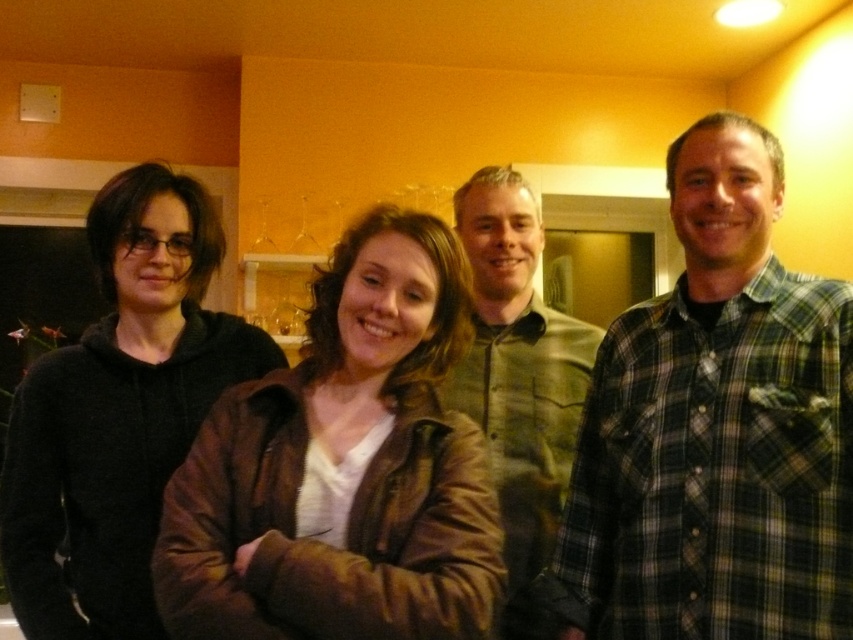
Question: Which point appears farthest from the camera in this image?

Choices:
 (A) (724, 429)
 (B) (160, 170)
 (C) (514, 440)
 (D) (383, 492)

Answer: (C)

Question: Observing the image, what is the correct spatial positioning of brown leather jacket at center in reference to green plaid shirt at center?

Choices:
 (A) right
 (B) left

Answer: (B)

Question: Estimate the real-world distances between objects in this image. Which object is closer to the plaid flannel shirt at right?

Choices:
 (A) brown leather jacket at center
 (B) black hoodie at left

Answer: (A)

Question: Is plaid flannel shirt at right below brown leather jacket at center?

Choices:
 (A) yes
 (B) no

Answer: (B)

Question: Among these objects, which one is farthest from the camera?

Choices:
 (A) black hoodie at left
 (B) plaid flannel shirt at right
 (C) green plaid shirt at center
 (D) brown leather jacket at center

Answer: (C)

Question: Does plaid flannel shirt at right appear on the left side of brown leather jacket at center?

Choices:
 (A) no
 (B) yes

Answer: (A)